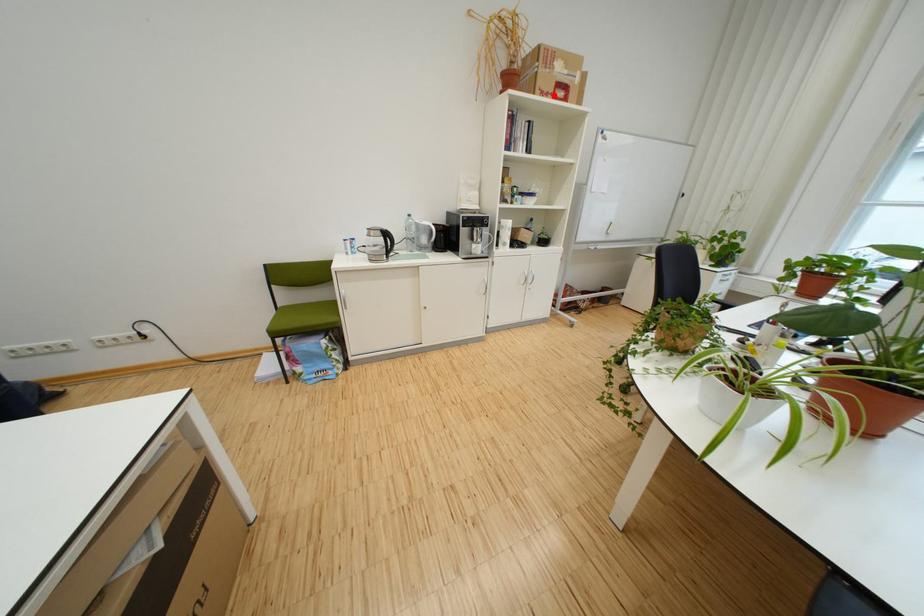
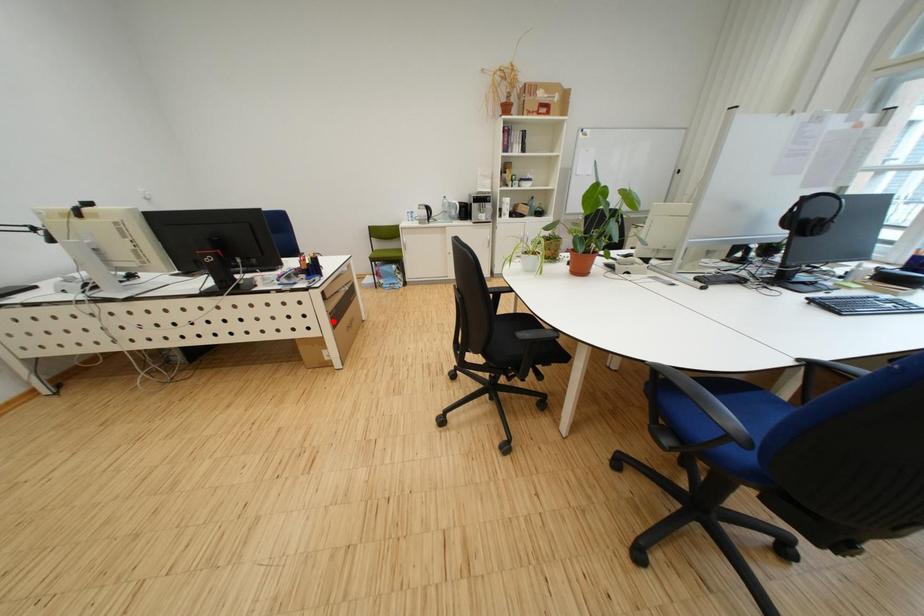
I am providing you with two images of the same scene from different viewpoints. A red point is marked on the first image and another point is marked on the second image. Is the marked point in image1 the same physical position as the marked point in image2?

No